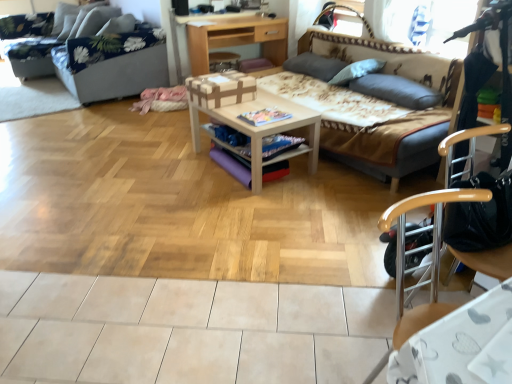
Question: Is floral fabric studio couch at upper left, arranged as the 2th studio couch when viewed from the right, smaller than wooden desk at center?

Choices:
 (A) yes
 (B) no

Answer: (B)

Question: Considering the relative sizes of floral fabric studio couch at upper left, the first studio couch when ordered from left to right, and wooden desk at center in the image provided, is floral fabric studio couch at upper left, the first studio couch when ordered from left to right, wider than wooden desk at center?

Choices:
 (A) yes
 (B) no

Answer: (A)

Question: Does floral fabric studio couch at upper left, arranged as the 2th studio couch when viewed from the right, turn towards wooden desk at center?

Choices:
 (A) yes
 (B) no

Answer: (B)

Question: Considering the relative positions of floral fabric studio couch at upper left, arranged as the 2th studio couch when viewed from the right, and wooden desk at center in the image provided, is floral fabric studio couch at upper left, arranged as the 2th studio couch when viewed from the right, in front of wooden desk at center?

Choices:
 (A) yes
 (B) no

Answer: (A)

Question: Is wooden desk at center surrounded by floral fabric studio couch at upper left, the first studio couch when ordered from left to right?

Choices:
 (A) no
 (B) yes

Answer: (A)

Question: Would you say gray fabric pillow at upper right, marked as the first pillow in a front-to-back arrangement, is inside or outside wooden desk at center?

Choices:
 (A) outside
 (B) inside

Answer: (A)

Question: From the image's perspective, is gray fabric pillow at upper right, placed as the 3th pillow when sorted from back to front, positioned above or below wooden desk at center?

Choices:
 (A) below
 (B) above

Answer: (A)

Question: Considering their positions, is gray fabric pillow at upper right, marked as the first pillow in a front-to-back arrangement, located in front of or behind wooden desk at center?

Choices:
 (A) behind
 (B) front

Answer: (B)

Question: Is point (364, 91) positioned closer to the camera than point (247, 26)?

Choices:
 (A) farther
 (B) closer

Answer: (B)

Question: Considering the positions of point (343, 74) and point (262, 18), is point (343, 74) closer or farther from the camera than point (262, 18)?

Choices:
 (A) farther
 (B) closer

Answer: (B)

Question: Is gray fabric pillow at upper right, the second pillow viewed from the back, to the left or to the right of wooden desk at center in the image?

Choices:
 (A) left
 (B) right

Answer: (B)

Question: In the image, is gray fabric pillow at upper right, the second pillow viewed from the back, positioned in front of or behind wooden desk at center?

Choices:
 (A) front
 (B) behind

Answer: (A)

Question: Would you say gray fabric pillow at upper right, the second pillow viewed from the back, is inside or outside wooden desk at center?

Choices:
 (A) outside
 (B) inside

Answer: (A)

Question: Is wooden desk at center to the left or to the right of gray fabric pillow at upper right, the second pillow viewed from the back, in the image?

Choices:
 (A) right
 (B) left

Answer: (B)

Question: Is wooden desk at center inside or outside of gray fabric pillow at upper right, the second pillow viewed from the back?

Choices:
 (A) inside
 (B) outside

Answer: (B)